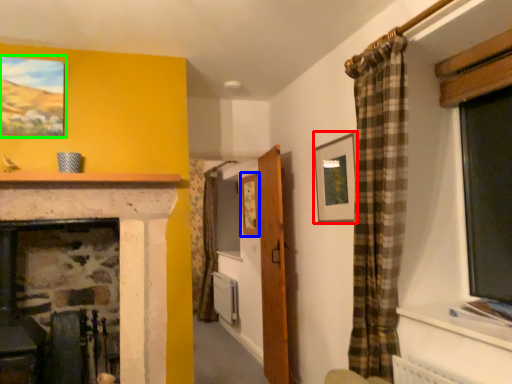
Question: Considering the real-world distances, which object is closest to picture frame (highlighted by a red box)? picture frame (highlighted by a blue box) or picture frame (highlighted by a green box).

Choices:
 (A) picture frame
 (B) picture frame

Answer: (A)